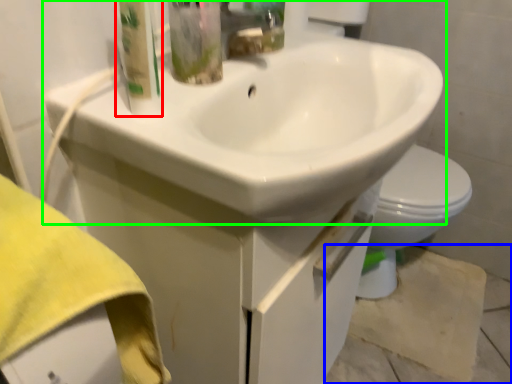
Question: Based on their relative distances, which object is nearer to cleaning product (highlighted by a red box)? Choose from concrete (highlighted by a blue box) and sink (highlighted by a green box).

Choices:
 (A) concrete
 (B) sink

Answer: (B)